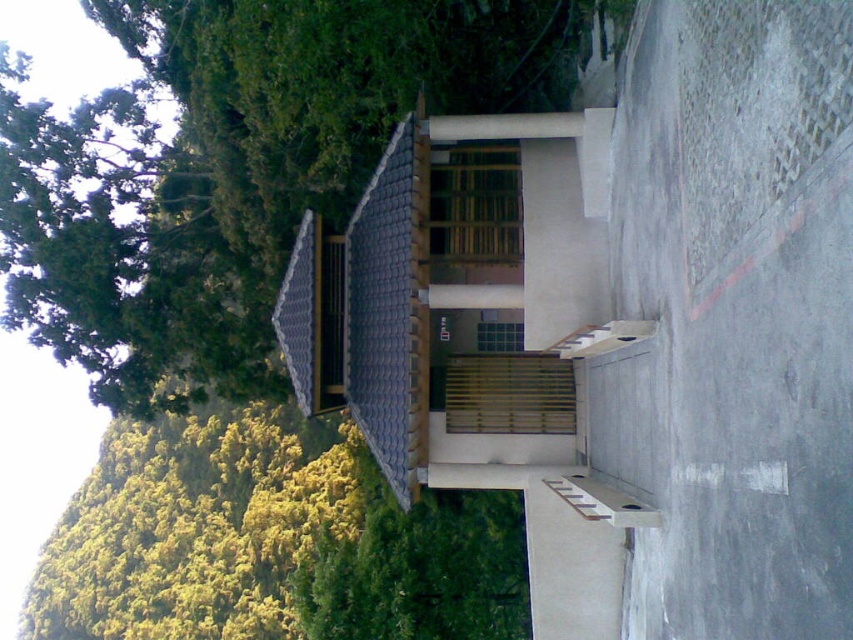
You are standing in front of the building and want to take a photo of the green leafy tree at upper left. Where should you position yourself to capture the tree in the frame?

The green leafy tree at upper left is located at point (236,166), so you should position yourself in front of the building and aim your camera slightly to the upper left to capture the tree in the frame.

You are standing at the entrance of the building and want to go to the wooden stairs at lower center. Which direction should you walk to avoid the green leafy tree at upper left?

Since the green leafy tree at upper left is positioned on the left side of the wooden stairs at lower center, you should walk to the right to reach the wooden stairs at lower center while avoiding the tree.

You are planning to install a new bench in the garden. The bench requires a space that is wider than the wooden stairs at lower center. Based on the scene, is the green leafy tree at upper left a suitable location for the bench?

The green leafy tree at upper left might be wider than the wooden stairs at lower center, so it could potentially provide enough space for the bench. However, since the tree itself occupies the area, placing a bench there may not be feasible due to the tree occupying the space.